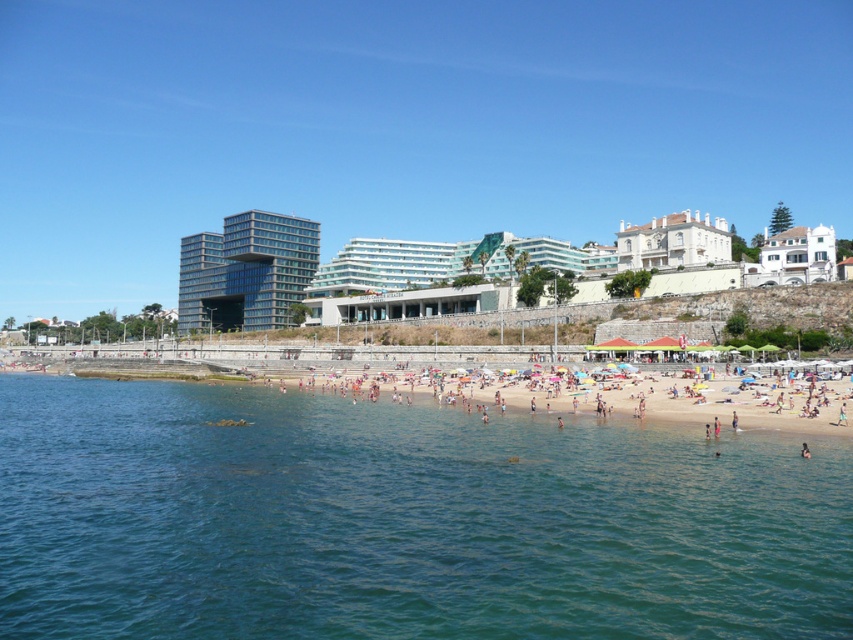
You are a GUI agent. You are given a task and a screenshot of the screen. Output one action in this format:
    pyautogui.click(x=<x>, y=<y>)
    Task: Click on the white glossy house at upper right
    The width and height of the screenshot is (853, 640).
    Given the screenshot: What is the action you would take?
    pyautogui.click(x=672, y=241)

Can you confirm if white glossy house at upper right is positioned to the left of dark blue fabric at beach center?

In fact, white glossy house at upper right is to the right of dark blue fabric at beach center.

Find the location of a particular element. This screenshot has height=640, width=853. white glossy house at upper right is located at coordinates (672, 241).

Does glassy modern building at center have a smaller size compared to dark blue fabric at beach center?

Incorrect, glassy modern building at center is not smaller in size than dark blue fabric at beach center.

Does glassy modern building at center appear on the right side of dark blue fabric at beach center?

Incorrect, glassy modern building at center is not on the right side of dark blue fabric at beach center.

Who is more distant from viewer, [254,221] or [801,452]?

Point [254,221]

Identify the location of glassy modern building at center. (247, 272).

Does glassy modern building at center lie in front of white matte house at upper right?

No, glassy modern building at center is further to the viewer.

Does point (206, 316) lie behind point (804, 243)?

Yes, point (206, 316) is farther from viewer.

Is point (194, 312) farther from viewer compared to point (779, 262)?

That is True.

Where is `glassy modern building at center`? The image size is (853, 640). glassy modern building at center is located at coordinates (247, 272).